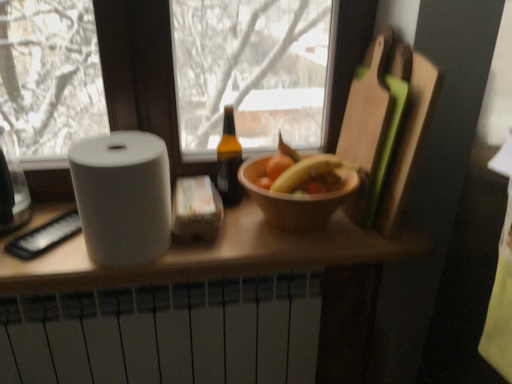
Question: Considering the relative positions of smooth wooden bowl at center and brown glass bottle at center in the image provided, is smooth wooden bowl at center to the right of brown glass bottle at center from the viewer's perspective?

Choices:
 (A) no
 (B) yes

Answer: (B)

Question: Is smooth wooden bowl at center positioned with its back to brown glass bottle at center?

Choices:
 (A) yes
 (B) no

Answer: (B)

Question: Is smooth wooden bowl at center placed right next to brown glass bottle at center?

Choices:
 (A) yes
 (B) no

Answer: (B)

Question: Can you confirm if smooth wooden bowl at center is smaller than brown glass bottle at center?

Choices:
 (A) yes
 (B) no

Answer: (B)

Question: From the image's perspective, is smooth wooden bowl at center beneath brown glass bottle at center?

Choices:
 (A) no
 (B) yes

Answer: (A)

Question: Is smooth wooden bowl at center positioned beyond the bounds of brown glass bottle at center?

Choices:
 (A) no
 (B) yes

Answer: (B)

Question: Are brown glass bottle at center and wooden cutting board at right located far from each other?

Choices:
 (A) yes
 (B) no

Answer: (B)

Question: Does brown glass bottle at center appear on the right side of wooden cutting board at right?

Choices:
 (A) no
 (B) yes

Answer: (A)

Question: Is brown glass bottle at center next to wooden cutting board at right?

Choices:
 (A) yes
 (B) no

Answer: (B)

Question: Can you confirm if brown glass bottle at center is positioned to the left of wooden cutting board at right?

Choices:
 (A) no
 (B) yes

Answer: (B)

Question: Is brown glass bottle at center facing away from wooden cutting board at right?

Choices:
 (A) yes
 (B) no

Answer: (B)

Question: From a real-world perspective, is brown glass bottle at center under wooden cutting board at right?

Choices:
 (A) no
 (B) yes

Answer: (B)

Question: From the image's perspective, would you say wooden bowl at center is positioned over white matte radiator at lower center?

Choices:
 (A) no
 (B) yes

Answer: (B)